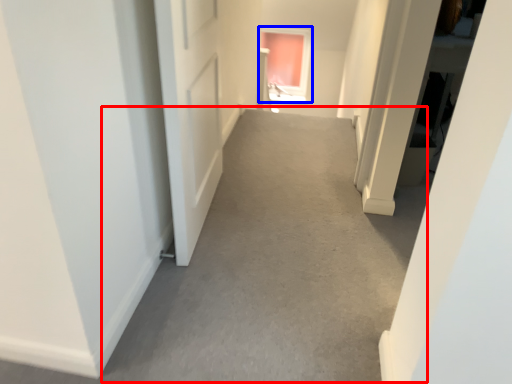
Question: Which point is further to the camera, alley (highlighted by a red box) or window (highlighted by a blue box)?

Choices:
 (A) alley
 (B) window

Answer: (B)